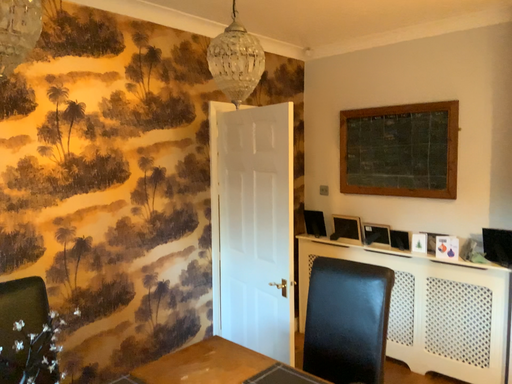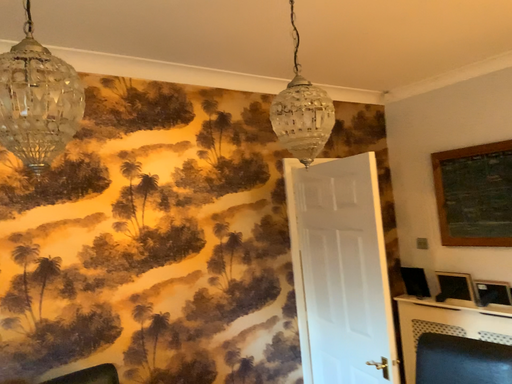
Question: How did the camera likely rotate when shooting the video?

Choices:
 (A) rotated right
 (B) rotated left

Answer: (B)